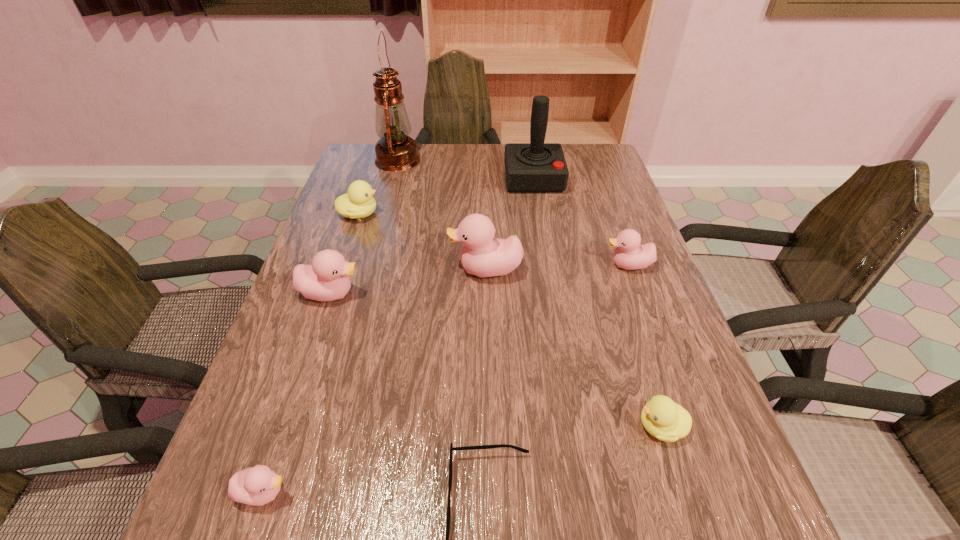
Find the location of `oil lamp present at the left edge`. oil lamp present at the left edge is located at coordinates (395, 151).

The image size is (960, 540). Find the location of `object at the far left corner`. object at the far left corner is located at coordinates (395, 151).

At what (x,y) coordinates should I click in order to perform the action: click on blank space at the far edge. Please return your answer as a coordinate pair (x, y). This screenshot has width=960, height=540. Looking at the image, I should click on (489, 166).

At what (x,y) coordinates should I click in order to perform the action: click on free region at the near edge of the desktop. Please return your answer as a coordinate pair (x, y). This screenshot has width=960, height=540. Looking at the image, I should click on (408, 533).

The image size is (960, 540). In the image, there is a desktop. Find the location of `vacant area at the left edge`. vacant area at the left edge is located at coordinates (305, 354).

In the image, there is a desktop. Identify the location of blank space at the right edge. (608, 238).

Where is `free space that is in between the tallest object and the fourth duckling from left to right`? free space that is in between the tallest object and the fourth duckling from left to right is located at coordinates (x=442, y=215).

Locate an element on the screen. The height and width of the screenshot is (540, 960). free space between the joystick and the fifth shortest duckling is located at coordinates (432, 236).

The height and width of the screenshot is (540, 960). I want to click on vacant point located between the nearer yellow duckling and the smallest pink duckling, so click(463, 459).

Where is `blank region between the fourth tallest object and the joystick`? Image resolution: width=960 pixels, height=540 pixels. blank region between the fourth tallest object and the joystick is located at coordinates (432, 236).